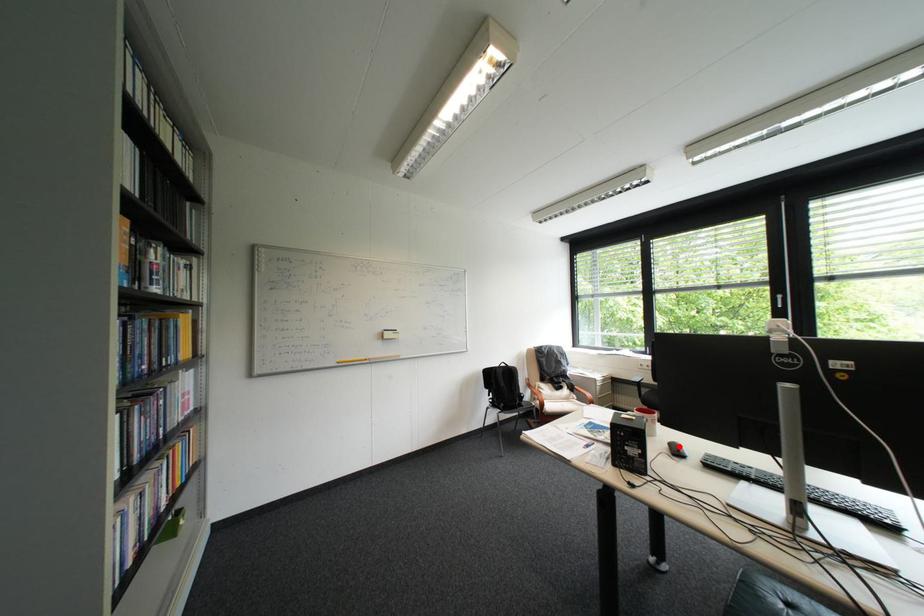
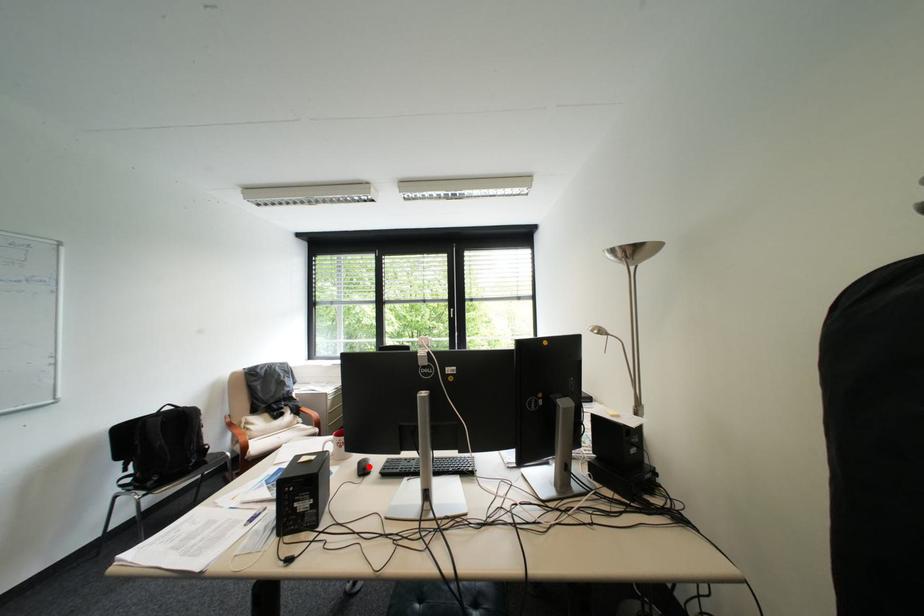
I am providing you with two images of the same scene from different viewpoints. A red point is marked on the first image and another point is marked on the second image. Is the marked point in image1 the same physical position as the marked point in image2?

Yes